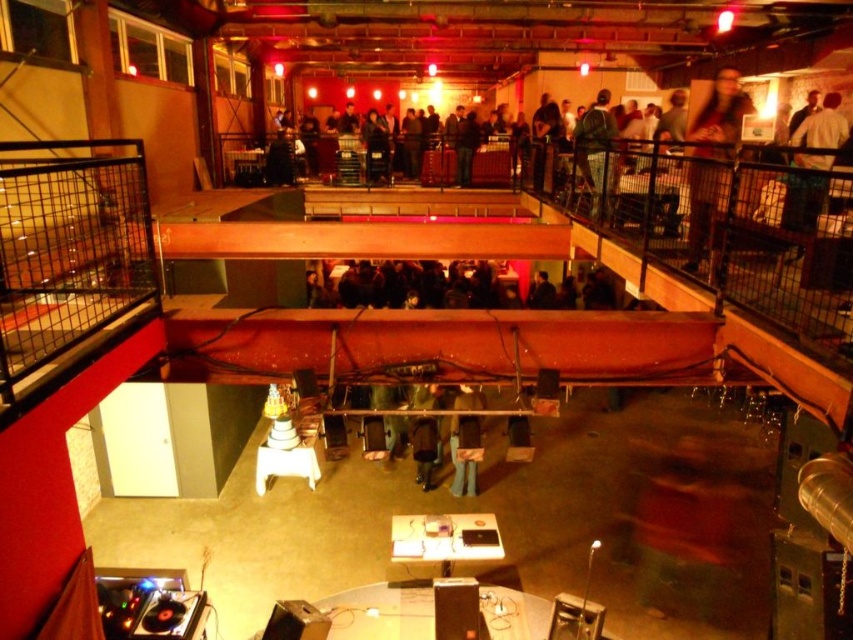
Question: Does brown fuzzy coat at upper right have a larger size compared to dark gray jacket at upper right?

Choices:
 (A) no
 (B) yes

Answer: (A)

Question: Can you confirm if light brown leather jacket at upper right is wider than dark gray jacket at upper right?

Choices:
 (A) yes
 (B) no

Answer: (B)

Question: Does light brown leather jacket at upper right appear on the left side of dark gray jacket at upper right?

Choices:
 (A) yes
 (B) no

Answer: (B)

Question: Based on their relative distances, which object is nearer to the brown fuzzy coat at upper right?

Choices:
 (A) dark gray jacket at upper right
 (B) light brown leather jacket at upper right

Answer: (A)

Question: Which object is positioned closest to the light brown leather jacket at upper right?

Choices:
 (A) brown fuzzy coat at upper right
 (B) dark gray jacket at upper right

Answer: (A)

Question: Which point is closer to the camera?

Choices:
 (A) (587, 122)
 (B) (816, 134)

Answer: (B)